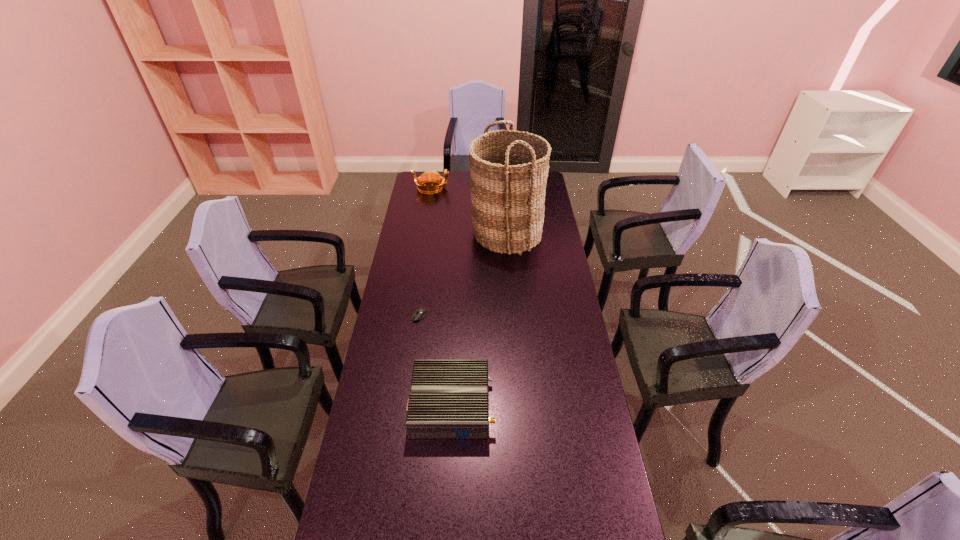
Image resolution: width=960 pixels, height=540 pixels. I want to click on vacant area that lies between the tallest object and the tiara, so tap(468, 211).

The width and height of the screenshot is (960, 540). I want to click on free space between the nearest object and the third nearest object, so click(479, 319).

Identify the location of free spot between the farthest object and the nearest object. The image size is (960, 540). coord(442,296).

The width and height of the screenshot is (960, 540). In order to click on unoccupied position between the nearest object and the tallest object in this screenshot , I will do `click(479, 319)`.

Locate an element on the screen. vacant space that's between the tiara and the third nearest object is located at coordinates (468, 211).

You are a GUI agent. You are given a task and a screenshot of the screen. Output one action in this format:
    pyautogui.click(x=<x>, y=<y>)
    Task: Click on the object that is the closest one to the tiara
    The height and width of the screenshot is (540, 960).
    Given the screenshot: What is the action you would take?
    pyautogui.click(x=509, y=169)

What are the coordinates of `object that stands as the second closest to the second tallest object` in the screenshot? It's located at (419, 313).

This screenshot has width=960, height=540. I want to click on vacant space that satisfies the following two spatial constraints: 1. at the front emblem of the tiara; 2. on the right side of the second nearest object, so click(411, 316).

Where is `free space that satisfies the following two spatial constraints: 1. on the back side of the third nearest object; 2. at the front emblem of the farthest object`? The width and height of the screenshot is (960, 540). free space that satisfies the following two spatial constraints: 1. on the back side of the third nearest object; 2. at the front emblem of the farthest object is located at coordinates (503, 188).

Image resolution: width=960 pixels, height=540 pixels. In order to click on vacant space that satisfies the following two spatial constraints: 1. on the back side of the basket; 2. at the front emblem of the third shortest object in this screenshot , I will do `click(503, 188)`.